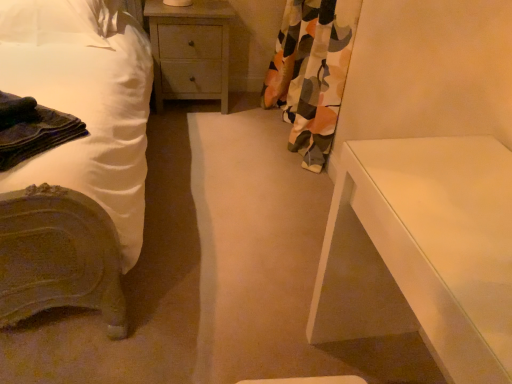
Measure the distance between point [185,36] and camera.

They are 2.60 meters apart.

What is the approximate height of dark blue fabric at left?

It is 9.38 centimeters.

Describe the element at coordinates (422, 251) in the screenshot. I see `white smooth table at right` at that location.

What are the coordinates of `wooden nightstand at center` in the screenshot? It's located at (190, 50).

Find the location of a particular element. This screenshot has height=384, width=512. curtain on the left of white smooth table at right is located at coordinates (311, 73).

In the scene shown: How many degrees apart are the facing directions of floral fabric curtain at right and white smooth table at right?

The angle between the facing direction of floral fabric curtain at right and the facing direction of white smooth table at right is 2.98 degrees.

Based on the photo, considering the relative sizes of floral fabric curtain at right and white smooth table at right in the image provided, is floral fabric curtain at right wider than white smooth table at right?

No.

Based on the photo, can you confirm if wooden nightstand at center is smaller than white smooth table at right?

Yes, wooden nightstand at center is smaller than white smooth table at right.

Is wooden nightstand at center at the right side of white smooth table at right?

No.

Based on the photo, does wooden nightstand at center turn towards white smooth table at right?

Yes, wooden nightstand at center is aimed at white smooth table at right.

Between point (195, 25) and point (371, 335), which one is positioned in front?

The point (371, 335) is more forward.

How far apart are floral fabric curtain at right and wooden nightstand at center?

The distance of floral fabric curtain at right from wooden nightstand at center is 24.34 inches.

From the image's perspective, between floral fabric curtain at right and wooden nightstand at center, who is located below?

floral fabric curtain at right is shown below in the image.

Between point (306, 9) and point (155, 17), which one is positioned in front?

Point (306, 9)

From the picture: Is floral fabric curtain at right inside or outside of wooden nightstand at center?

floral fabric curtain at right is located beyond the bounds of wooden nightstand at center.

Consider the image. Is wooden nightstand at center turned away from floral fabric curtain at right?

No, wooden nightstand at center is not facing the opposite direction of floral fabric curtain at right.

Is point (172, 98) positioned in front of point (298, 86)?

No, it is behind (298, 86).

Is wooden nightstand at center next to floral fabric curtain at right and touching it?

They are not placed beside each other.

Is wooden nightstand at center to the left of floral fabric curtain at right from the viewer's perspective?

Yes.

In the image, there is a white fabric pillow at upper left. At what (x,y) coordinates should I click in order to perform the action: click on material below it (from the image's perspective). Please return your answer as a coordinate pair (x, y). The width and height of the screenshot is (512, 384). Looking at the image, I should click on (32, 129).

From the image's perspective, which one is positioned higher, dark blue fabric at left or white fabric pillow at upper left?

white fabric pillow at upper left appears higher in the image.

Is white fabric pillow at upper left inside or outside of dark blue fabric at left?

white fabric pillow at upper left is located beyond the bounds of dark blue fabric at left.

From a real-world perspective, who is located higher, white fabric pillow at upper left or dark blue fabric at left?

In real-world perspective, white fabric pillow at upper left is above.

Is point (79, 16) positioned in front of point (18, 120)?

No, (79, 16) is further to viewer.

Which of these two, dark blue fabric at left or wooden nightstand at center, is bigger?

Bigger between the two is wooden nightstand at center.

The height and width of the screenshot is (384, 512). Find the location of `the chest of drawers that appears below the dark blue fabric at left (from a real-world perspective)`. the chest of drawers that appears below the dark blue fabric at left (from a real-world perspective) is located at coordinates (190, 50).

Looking at this image, between dark blue fabric at left and wooden nightstand at center, which one has less height?

Standing shorter between the two is dark blue fabric at left.

Does dark blue fabric at left appear on the right side of wooden nightstand at center?

No.

The height and width of the screenshot is (384, 512). I want to click on curtain lying behind the white smooth table at right, so click(311, 73).

Image resolution: width=512 pixels, height=384 pixels. I want to click on nightstand in front of the wooden nightstand at center, so click(422, 251).

Considering their positions, is dark blue fabric at left positioned closer to white smooth table at right than white matte bed at left?

The object closer to white smooth table at right is white matte bed at left.

Estimate the real-world distances between objects in this image. Which object is closer to white fabric pillow at upper left, wooden nightstand at center or dark blue fabric at left?

wooden nightstand at center is positioned closer to the anchor white fabric pillow at upper left.

Based on their spatial positions, is floral fabric curtain at right or white matte bed at left further from white fabric pillow at upper left?

Based on the image, floral fabric curtain at right appears to be further to white fabric pillow at upper left.

Looking at the image, which one is located further to dark blue fabric at left, white matte bed at left or wooden nightstand at center?

Based on the image, wooden nightstand at center appears to be further to dark blue fabric at left.

From the image, which object appears to be nearer to white matte bed at left, dark blue fabric at left or floral fabric curtain at right?

The object closer to white matte bed at left is dark blue fabric at left.

Which object lies nearer to the anchor point wooden nightstand at center, white smooth table at right or white fabric pillow at upper left?

white fabric pillow at upper left lies closer to wooden nightstand at center than the other object.

Which object lies further to the anchor point white fabric pillow at upper left, white matte bed at left or wooden nightstand at center?

The object further to white fabric pillow at upper left is wooden nightstand at center.

From the image, which object appears to be farther from white matte bed at left, dark blue fabric at left or white smooth table at right?

white smooth table at right is further to white matte bed at left.

Locate an element on the screen. This screenshot has height=384, width=512. chest of drawers between white fabric pillow at upper left and floral fabric curtain at right is located at coordinates (190, 50).

You are a GUI agent. You are given a task and a screenshot of the screen. Output one action in this format:
    pyautogui.click(x=<x>, y=<y>)
    Task: Click on the bed positioned between white smooth table at right and wooden nightstand at center from near to far
    
    Given the screenshot: What is the action you would take?
    pyautogui.click(x=75, y=157)

Locate an element on the screen. The width and height of the screenshot is (512, 384). material between white matte bed at left and floral fabric curtain at right from left to right is located at coordinates (32, 129).

The image size is (512, 384). What are the coordinates of `pillow between dark blue fabric at left and wooden nightstand at center along the z-axis` in the screenshot? It's located at (59, 22).